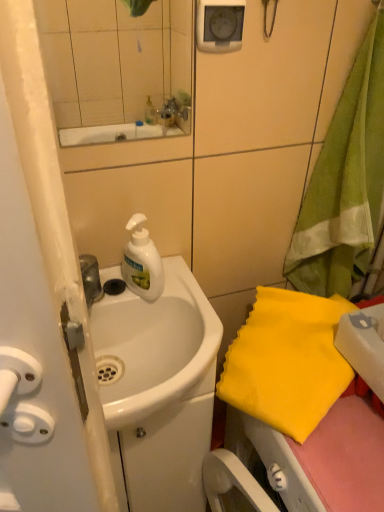
Question: From a real-world perspective, does yellow fabric at right, which is counted as the first beach towel, starting from the top, sit lower than yellow fabric at lower right, the 2th beach towel in the top-to-bottom sequence?

Choices:
 (A) no
 (B) yes

Answer: (A)

Question: Is yellow fabric at right, arranged as the 2th beach towel when ordered from the bottom, at the right side of yellow fabric at lower right, the 2th beach towel in the top-to-bottom sequence?

Choices:
 (A) yes
 (B) no

Answer: (A)

Question: Is yellow fabric at right, arranged as the 2th beach towel when ordered from the bottom, further to camera compared to yellow fabric at lower right, the 2th beach towel in the top-to-bottom sequence?

Choices:
 (A) no
 (B) yes

Answer: (A)

Question: Is yellow fabric at right, arranged as the 2th beach towel when ordered from the bottom, oriented towards yellow fabric at lower right, the 1th beach towel positioned from the bottom?

Choices:
 (A) no
 (B) yes

Answer: (A)

Question: Can you confirm if yellow fabric at right, arranged as the 2th beach towel when ordered from the bottom, is smaller than yellow fabric at lower right, the 2th beach towel in the top-to-bottom sequence?

Choices:
 (A) yes
 (B) no

Answer: (B)

Question: Is yellow fabric at right, which is counted as the first beach towel, starting from the top, thinner than yellow fabric at lower right, the 1th beach towel positioned from the bottom?

Choices:
 (A) yes
 (B) no

Answer: (A)

Question: Is yellow fabric at lower right, the 1th beach towel positioned from the bottom, positioned in front of yellow fabric at right, which is counted as the first beach towel, starting from the top?

Choices:
 (A) yes
 (B) no

Answer: (B)

Question: From the image's perspective, is yellow fabric at lower right, the 2th beach towel in the top-to-bottom sequence, above yellow fabric at right, arranged as the 2th beach towel when ordered from the bottom?

Choices:
 (A) no
 (B) yes

Answer: (A)

Question: Is yellow fabric at lower right, the 1th beach towel positioned from the bottom, further to camera compared to yellow fabric at right, arranged as the 2th beach towel when ordered from the bottom?

Choices:
 (A) no
 (B) yes

Answer: (B)

Question: Is yellow fabric at lower right, the 2th beach towel in the top-to-bottom sequence, bigger than yellow fabric at right, arranged as the 2th beach towel when ordered from the bottom?

Choices:
 (A) yes
 (B) no

Answer: (B)

Question: From a real-world perspective, is yellow fabric at lower right, the 2th beach towel in the top-to-bottom sequence, positioned over yellow fabric at right, arranged as the 2th beach towel when ordered from the bottom, based on gravity?

Choices:
 (A) yes
 (B) no

Answer: (B)

Question: Would you say yellow fabric at lower right, the 2th beach towel in the top-to-bottom sequence, is outside yellow fabric at right, which is counted as the first beach towel, starting from the top?

Choices:
 (A) yes
 (B) no

Answer: (A)

Question: Is white matte liquid soap at center not near white glossy sink at center?

Choices:
 (A) yes
 (B) no

Answer: (B)